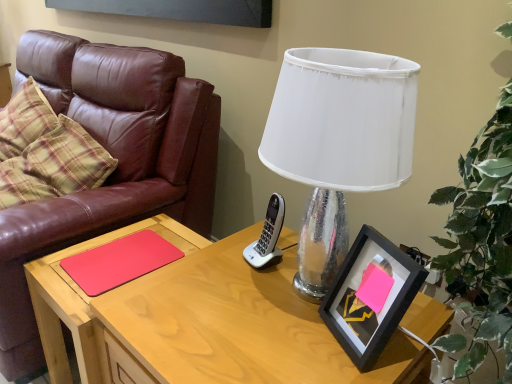
Locate an element on the screen. Image resolution: width=512 pixels, height=384 pixels. vacant space situated above red matte wood side table at left (from a real-world perspective) is located at coordinates point(127,253).